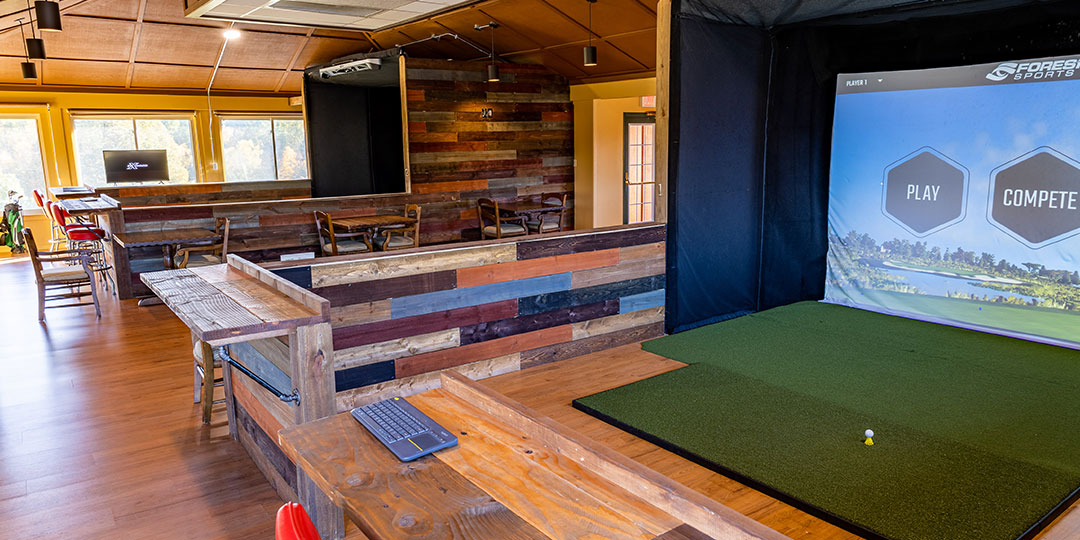
Where is `door`? This screenshot has height=540, width=1080. door is located at coordinates (642, 152).